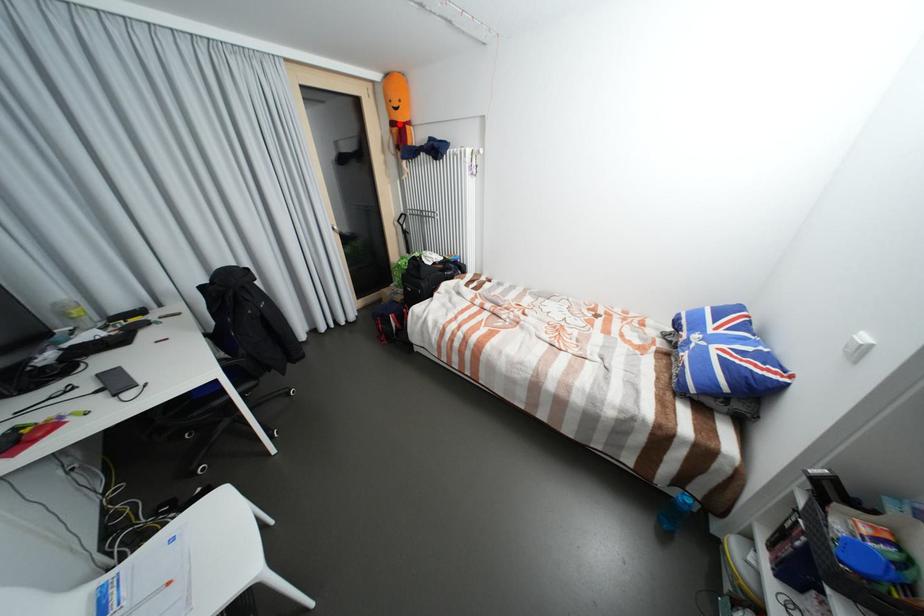
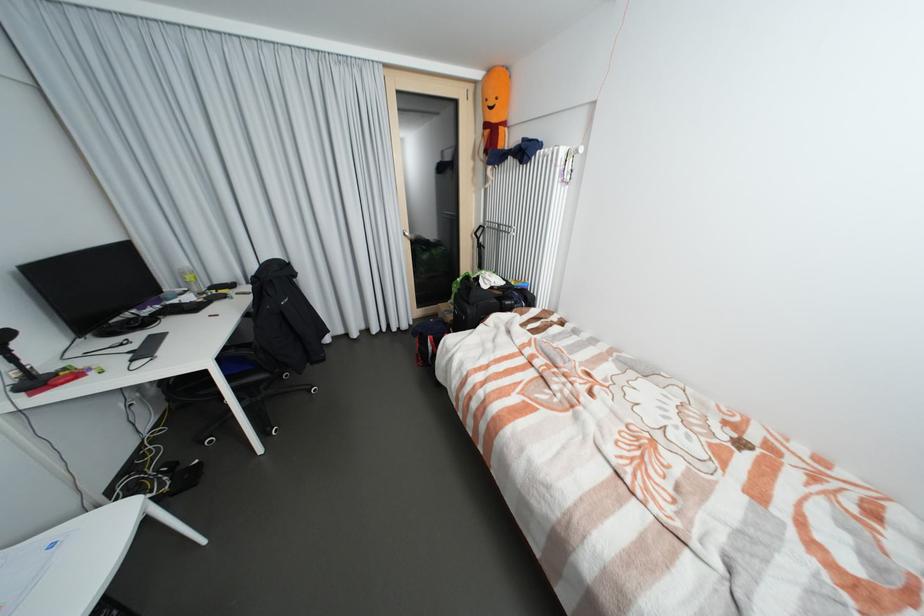
Locate, in the second image, the point that corresponds to the highlighted location in the first image.

(492, 126)